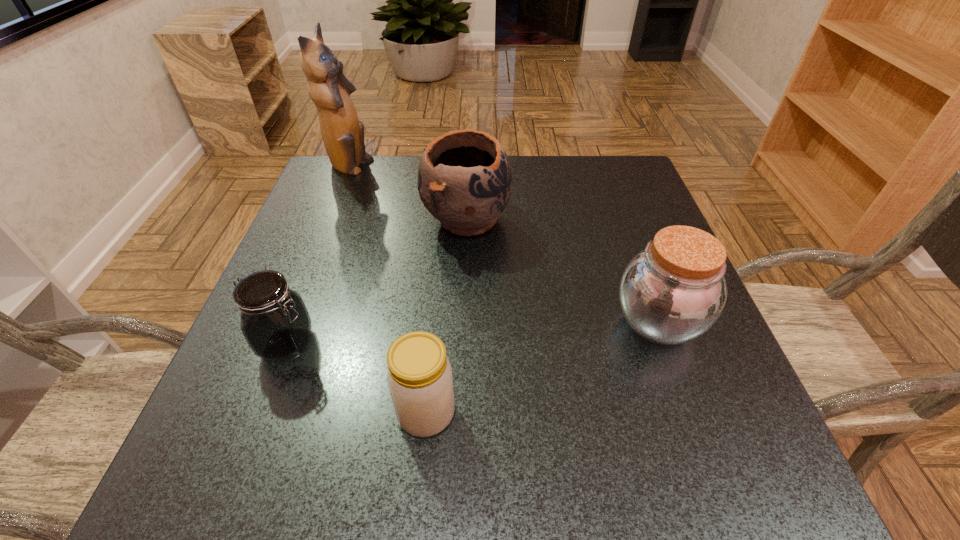
The height and width of the screenshot is (540, 960). What are the coordinates of `the tallest object` in the screenshot? It's located at (343, 134).

What are the coordinates of `the farthest object` in the screenshot? It's located at (343, 134).

Locate an element on the screen. This screenshot has width=960, height=540. the second farthest object is located at coordinates (464, 178).

The width and height of the screenshot is (960, 540). Identify the location of the tallest jar. (672, 292).

Identify the location of the rightmost object. This screenshot has width=960, height=540. (672, 292).

Identify the location of the second jar from left to right. (419, 375).

Where is `the nearest object`? the nearest object is located at coordinates (419, 375).

At what (x,y) coordinates should I click in order to perform the action: click on the leftmost jar. Please return your answer as a coordinate pair (x, y). The width and height of the screenshot is (960, 540). Looking at the image, I should click on (275, 322).

Identify the location of free space located 0.260m on the face of the cat. (470, 167).

You are a GUI agent. You are given a task and a screenshot of the screen. Output one action in this format:
    pyautogui.click(x=<x>, y=<y>)
    Task: Click on the vacant area situated 0.350m on the front of the fourth nearest object
    The height and width of the screenshot is (540, 960).
    Given the screenshot: What is the action you would take?
    pyautogui.click(x=460, y=399)